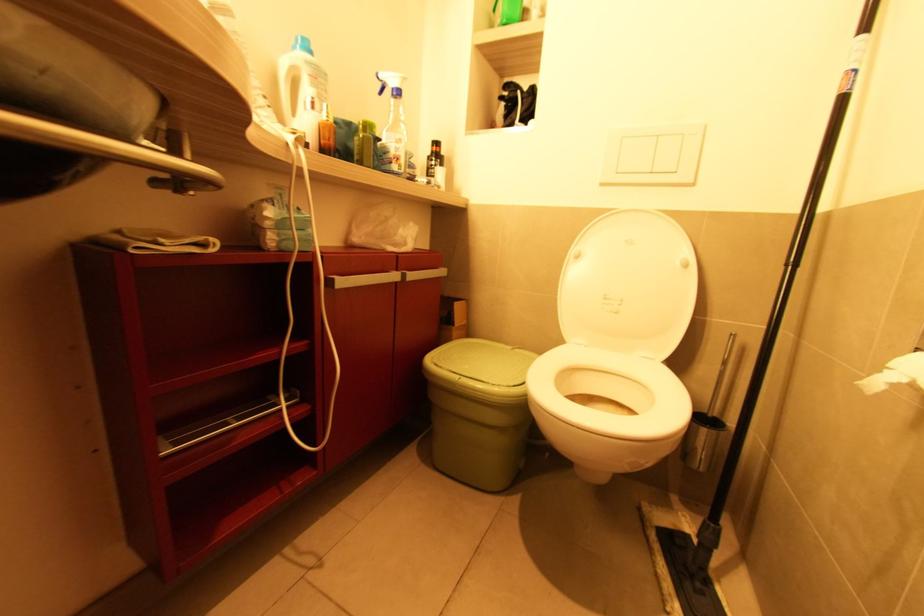
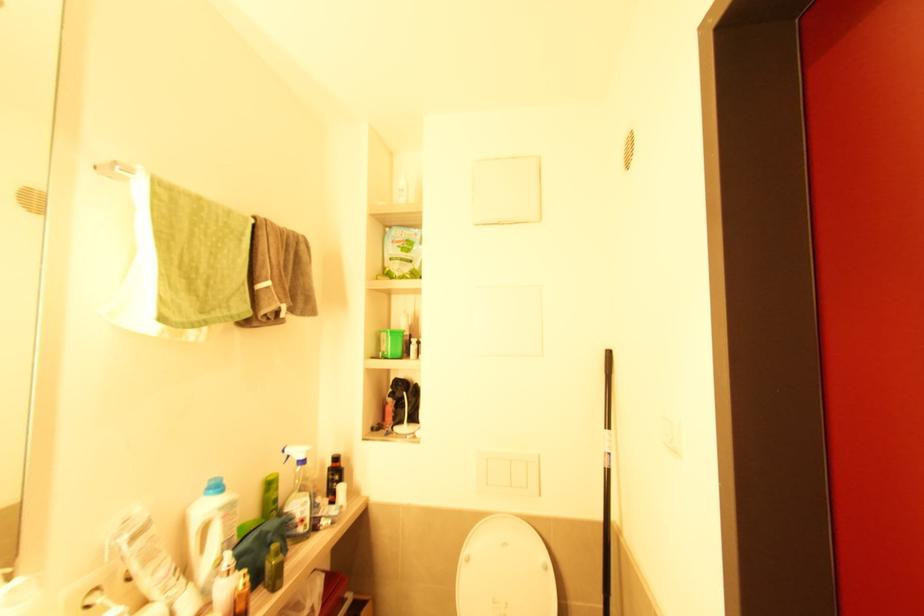
Locate, in the second image, the point that corresponds to point 845,98 in the first image.

(610, 472)